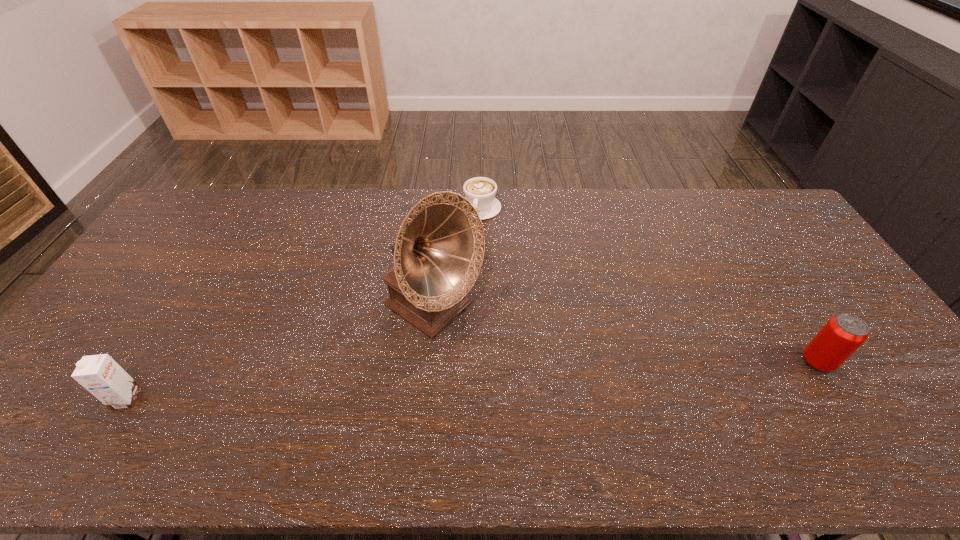
The image size is (960, 540). I want to click on vacant space at the far left corner, so click(x=191, y=206).

Locate an element on the screen. blank region between the chocolate milk and the can is located at coordinates (472, 380).

Image resolution: width=960 pixels, height=540 pixels. I want to click on vacant point located between the can and the chocolate milk, so click(472, 380).

What are the coordinates of `vacant space in between the can and the nearest object` in the screenshot? It's located at (472, 380).

Where is `free point between the leftmost object and the cappuccino`? free point between the leftmost object and the cappuccino is located at coordinates tap(303, 303).

Identify the location of vacant space that is in between the nearest object and the tallest object. Image resolution: width=960 pixels, height=540 pixels. (280, 355).

I want to click on free space between the shortest object and the nearest object, so click(303, 303).

Find the location of a particular element. free space between the can and the nearest object is located at coordinates (472, 380).

Find the location of `free spot between the cappuccino and the can`. free spot between the cappuccino and the can is located at coordinates (649, 285).

The image size is (960, 540). In order to click on vacant space that is in between the tallest object and the can in this screenshot , I will do `click(625, 336)`.